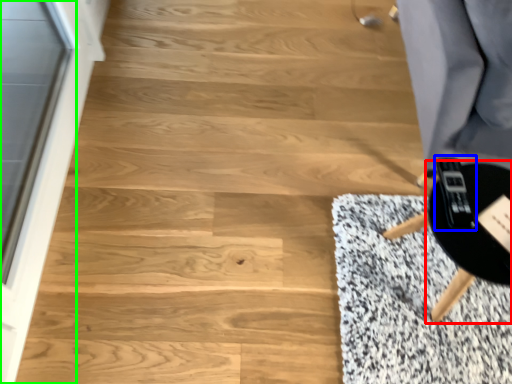
Question: Which is nearer to the round table (highlighted by a red box)? game controller (highlighted by a blue box) or screen door (highlighted by a green box).

Choices:
 (A) game controller
 (B) screen door

Answer: (A)